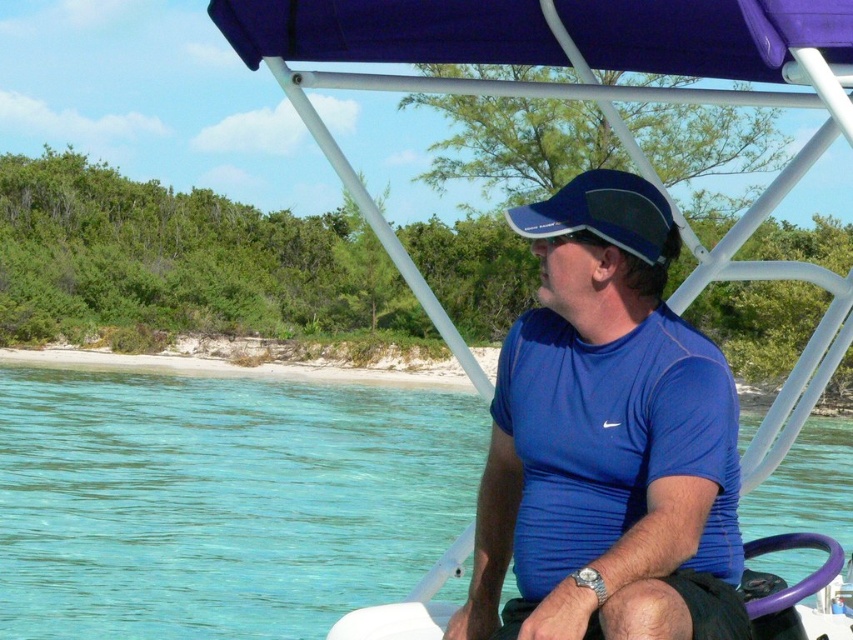
Between clear blue water at center and blue mesh shirt at center, which one appears on the right side from the viewer's perspective?

clear blue water at center is more to the right.

Does clear blue water at center appear over blue mesh shirt at center?

Actually, clear blue water at center is below blue mesh shirt at center.

In order to click on clear blue water at center in this screenshot , I will do `click(219, 500)`.

Does point (62, 513) lie in front of point (531, 228)?

That is False.

Who is taller, clear blue water at center or blue mesh baseball cap at center?

Standing taller between the two is clear blue water at center.

The width and height of the screenshot is (853, 640). Describe the element at coordinates (219, 500) in the screenshot. I see `clear blue water at center` at that location.

At what (x,y) coordinates should I click in order to perform the action: click on clear blue water at center. Please return your answer as a coordinate pair (x, y). This screenshot has width=853, height=640. Looking at the image, I should click on (219, 500).

Who is more distant from viewer, (688, 609) or (567, 193)?

The point (567, 193) is more distant.

Between blue mesh shirt at center and blue mesh baseball cap at center, which one has more height?

With more height is blue mesh shirt at center.

Describe the element at coordinates (606, 440) in the screenshot. Image resolution: width=853 pixels, height=640 pixels. I see `blue mesh shirt at center` at that location.

Find the location of a particular element. The height and width of the screenshot is (640, 853). blue mesh shirt at center is located at coordinates coord(606,440).